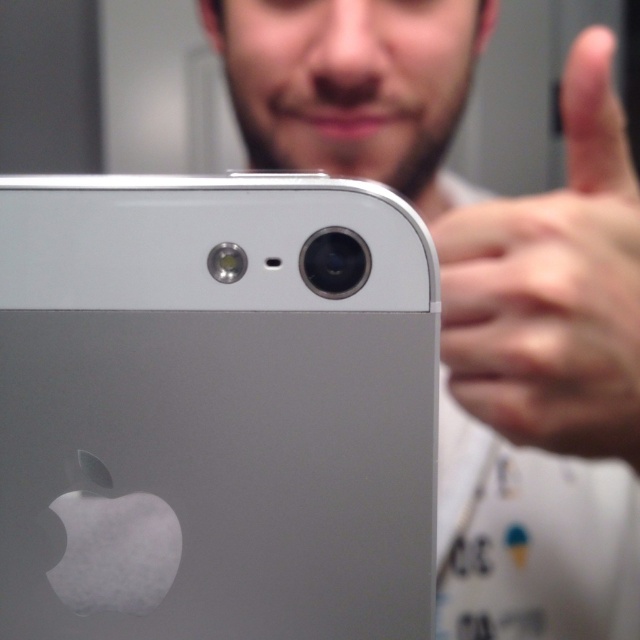
Is point (6, 573) positioned after point (540, 592)?

No, (6, 573) is in front of (540, 592).

Between point (168, 532) and point (449, 326), which one is positioned in front?

Point (168, 532) is in front.

This screenshot has width=640, height=640. Find the location of `sleek silver phone at center`. sleek silver phone at center is located at coordinates (216, 408).

Does point (632, 310) come farther from viewer compared to point (560, 246)?

No, (632, 310) is closer to viewer.

Who is higher up, matte silver phone at center or skinny flesh-toned hand at upper right?

Positioned higher is matte silver phone at center.

You are a GUI agent. You are given a task and a screenshot of the screen. Output one action in this format:
    pyautogui.click(x=<x>, y=<y>)
    Task: Click on the matte silver phone at center
    
    Given the screenshot: What is the action you would take?
    tap(484, 292)

Is the position of sleek silver phone at center more distant than that of skinny flesh-toned hand at upper right?

Yes, it is.

Who is more forward, (84,268) or (515,372)?

Point (84,268) is in front.

I want to click on sleek silver phone at center, so click(216, 408).